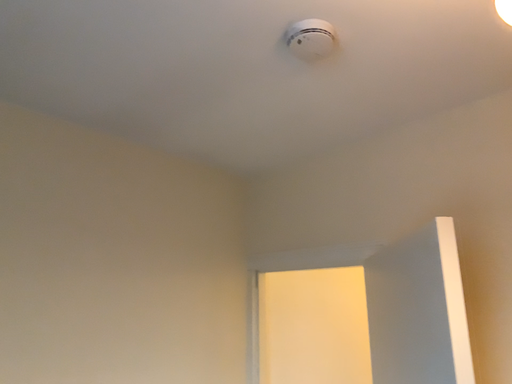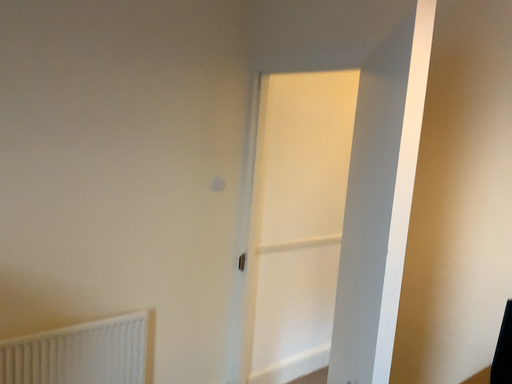
Question: How did the camera likely rotate when shooting the video?

Choices:
 (A) rotated upward
 (B) rotated downward

Answer: (B)